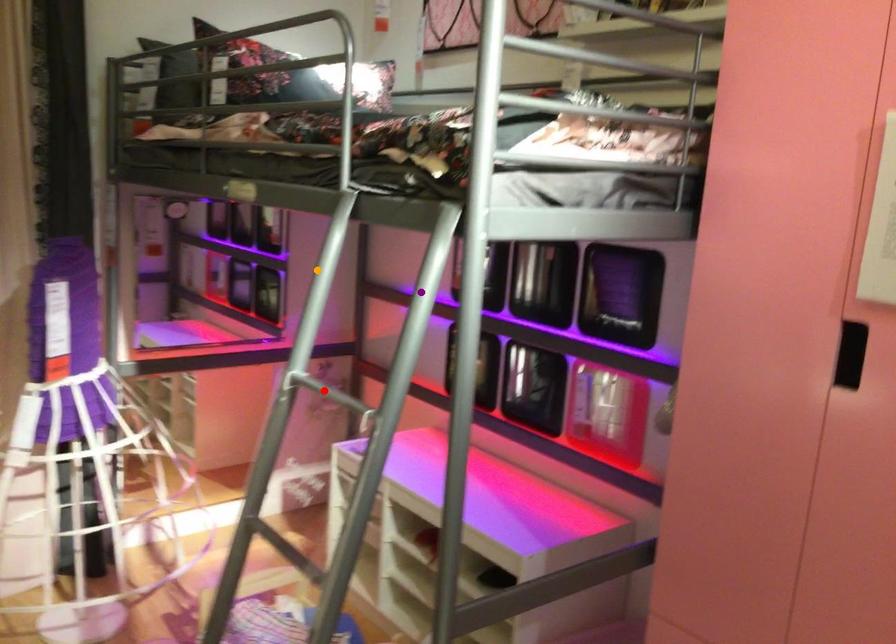
Order these from nearest to farthest:
orange point
red point
purple point

orange point, red point, purple point